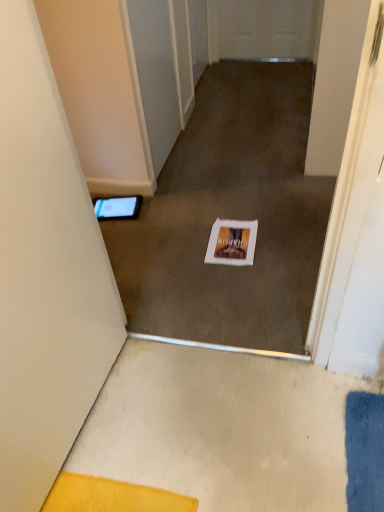
Where is `vacant space behind white paper at center`? The width and height of the screenshot is (384, 512). vacant space behind white paper at center is located at coordinates [216, 211].